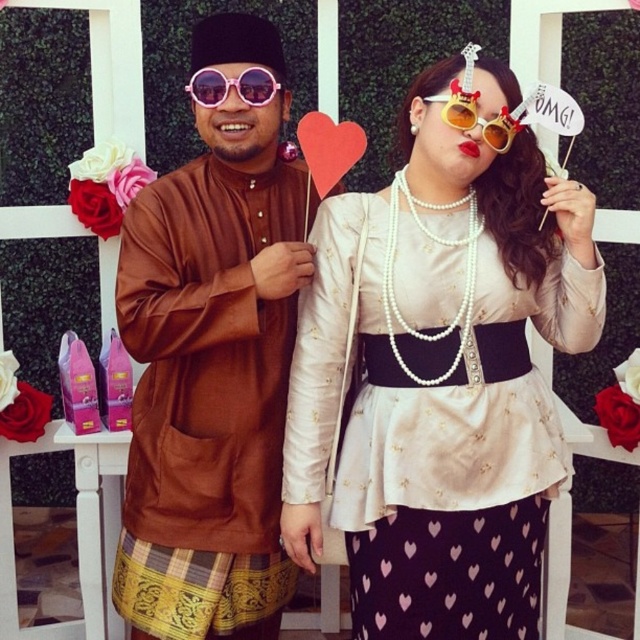
Does brown satin kurta at left appear over gold plastic sunglasses at upper center?

No.

Which of these two, brown satin kurta at left or gold plastic sunglasses at upper center, stands shorter?

gold plastic sunglasses at upper center is shorter.

Measure the distance between brown satin kurta at left and camera.

brown satin kurta at left and camera are 5.64 feet apart.

Where is `brown satin kurta at left`? The image size is (640, 640). brown satin kurta at left is located at coordinates (212, 362).

Can you confirm if gold plastic sunglasses at upper center is bigger than pink reflective sunglasses at center?

Yes, gold plastic sunglasses at upper center is bigger than pink reflective sunglasses at center.

Which is in front, point (484, 131) or point (216, 86)?

Point (484, 131) is in front.

Where is `gold plastic sunglasses at upper center`? gold plastic sunglasses at upper center is located at coordinates (481, 116).

Can you confirm if pearl satin blouse at center is positioned above brown satin kurta at left?

No.

In order to click on pearl satin blouse at center in this screenshot , I will do `click(442, 372)`.